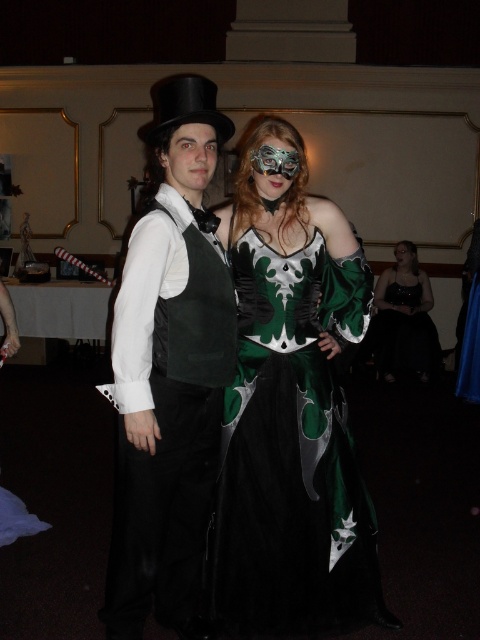
You are planning to sit between the green satin dress at center and the black satin dress at lower right. Which dress takes up more horizontal space?

The black satin dress at lower right takes up more horizontal space because its width is greater than the green satin dress at center.

You are a photographer at the event and need to adjust the lighting. The green satin dress at center and the matte black mask at center are too far apart for the current setup. What is the minimum distance you need to move the camera to ensure both are within the frame?

The green satin dress at center is 4.46 meters from the matte black mask at center. To ensure both are within the frame, the camera must be positioned so it can cover at least 4.46 meters between them, requiring a minimum distance adjustment to accommodate this spacing.